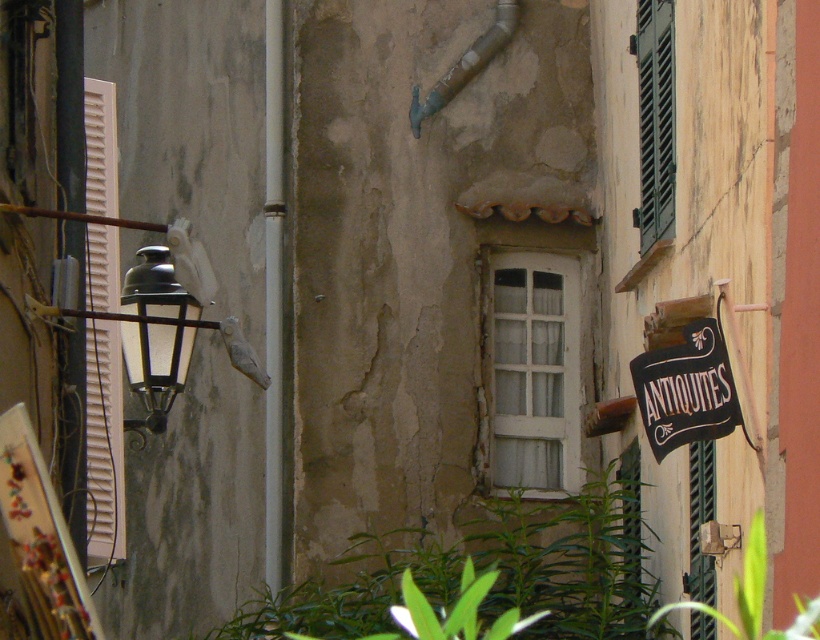
You are standing in the middle of the street and want to look at the black fabric sign at right. Which direction should you turn your head to see it?

The black fabric sign at right is located to your right side, so you should turn your head to the right to see it.

You are standing in the middle of the street looking at the beige wall. Which object is closer to your left side, the white wooden shutters at left or the green leafy plant at lower right?

The white wooden shutters at left is positioned on the left side of green leafy plant at lower right, so it is closer to your left side.